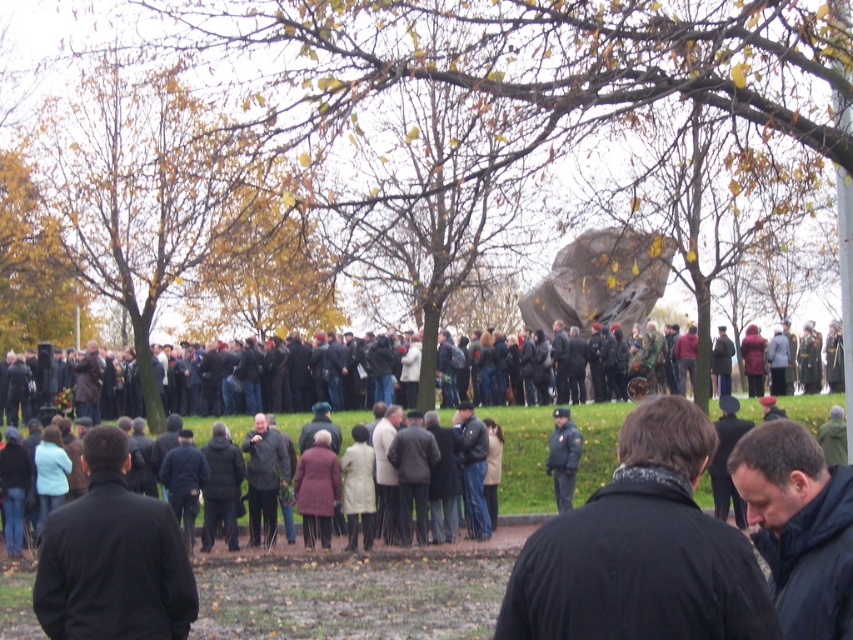
Which is above, black matte jacket at center or black matte jacket at lower left?

black matte jacket at center is above.

Is black matte jacket at center taller than black matte jacket at lower left?

Yes, black matte jacket at center is taller than black matte jacket at lower left.

Between point (680, 515) and point (178, 602), which one is positioned in front?

Point (680, 515)

Identify the location of black matte jacket at center. The height and width of the screenshot is (640, 853). (641, 548).

Between rustic stone monument at center and dark brown coat at center, which one is positioned higher?

Positioned higher is rustic stone monument at center.

Between point (635, 268) and point (793, 404), which one is positioned in front?

Point (793, 404) is more forward.

Does point (587, 282) come farther from viewer compared to point (531, 420)?

Yes.

Where is `rustic stone monument at center`? rustic stone monument at center is located at coordinates (601, 280).

Which is more to the right, black matte jacket at lower left or rustic stone monument at center?

From the viewer's perspective, rustic stone monument at center appears more on the right side.

Is point (80, 506) in front of point (599, 317)?

Yes.

Locate an element on the screen. Image resolution: width=853 pixels, height=640 pixels. black matte jacket at lower left is located at coordinates coord(113,557).

The height and width of the screenshot is (640, 853). What are the coordinates of `black matte jacket at lower left` in the screenshot? It's located at (113, 557).